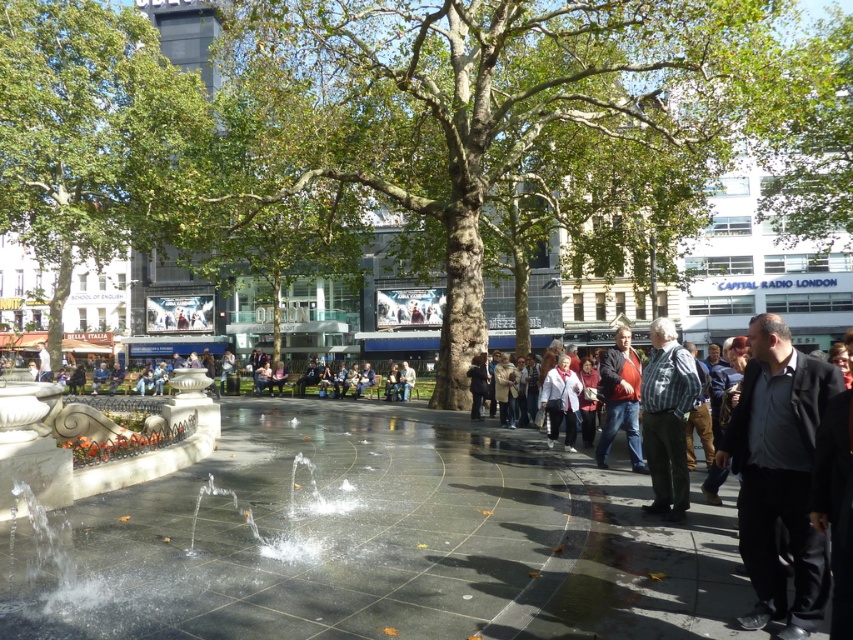
Question: Which object is the farthest from the striped cotton shirt at center-right?

Choices:
 (A) white matte jacket at center
 (B) green leafy tree at upper left
 (C) dark brown leather jacket at center

Answer: (B)

Question: In this image, where is green leafy tree at upper left located relative to white matte jacket at center?

Choices:
 (A) left
 (B) right

Answer: (A)

Question: Can you confirm if dark brown leather jacket at center is positioned above white matte jacket at center?

Choices:
 (A) yes
 (B) no

Answer: (A)

Question: Which object is positioned closest to the white matte jacket at center?

Choices:
 (A) dark brown leather jacket at center
 (B) striped cotton shirt at center-right
 (C) black matte jacket at right

Answer: (A)

Question: Can you confirm if striped cotton shirt at center-right is positioned to the right of white matte jacket at center?

Choices:
 (A) no
 (B) yes

Answer: (B)

Question: Among these points, which one is farthest from the camera?

Choices:
 (A) (548, 445)
 (B) (10, 1)
 (C) (618, 387)

Answer: (B)